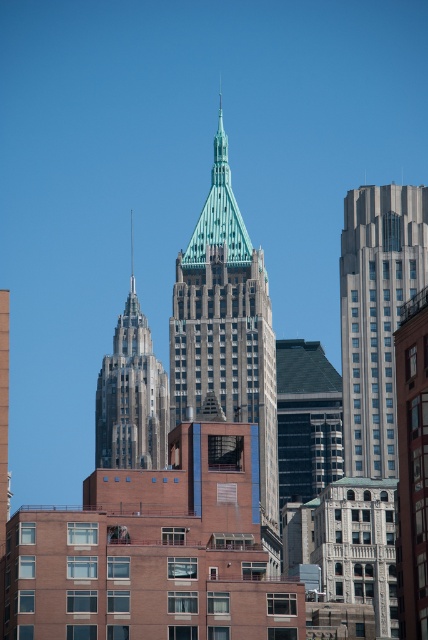
Question: Observing the image, what is the correct spatial positioning of green stone tower at center in reference to gray stone skyscraper at right?

Choices:
 (A) above
 (B) below

Answer: (B)

Question: Which point appears closest to the camera in this image?

Choices:
 (A) (100, 448)
 (B) (382, 262)

Answer: (B)

Question: Can you confirm if green stone tower at center is positioned to the left of gray stone skyscraper at right?

Choices:
 (A) yes
 (B) no

Answer: (A)

Question: Which object appears closest to the camera in this image?

Choices:
 (A) gray stone skyscraper at right
 (B) gray stone tower at left

Answer: (A)

Question: Which object is closer to the camera taking this photo?

Choices:
 (A) gray stone tower at left
 (B) gray stone skyscraper at right
 (C) green stone tower at center

Answer: (C)

Question: Does gray stone skyscraper at right appear over gray stone tower at left?

Choices:
 (A) no
 (B) yes

Answer: (B)